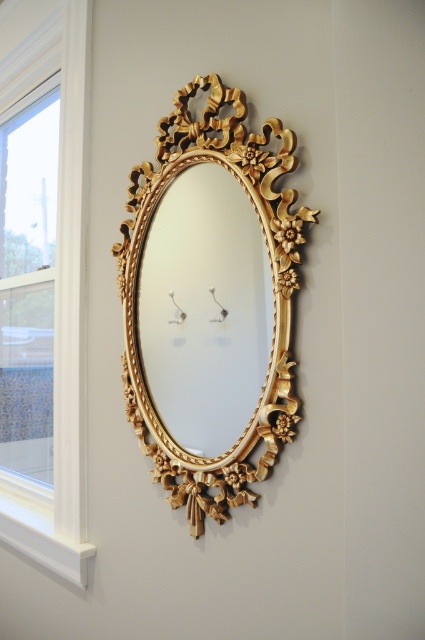
Question: Which of the following is the farthest from the observer?

Choices:
 (A) gold ornate mirror at center
 (B) gold ornate mirror at upper center

Answer: (B)

Question: Can you confirm if gold ornate mirror at upper center is positioned below gold ornate mirror at center?

Choices:
 (A) no
 (B) yes

Answer: (B)

Question: Can you confirm if gold ornate mirror at upper center is positioned below white wood window at left?

Choices:
 (A) yes
 (B) no

Answer: (A)

Question: Does gold ornate mirror at upper center appear under white wood window at left?

Choices:
 (A) yes
 (B) no

Answer: (A)

Question: Which of the following is the farthest from the observer?

Choices:
 (A) (178, 449)
 (B) (54, 332)

Answer: (B)

Question: Estimate the real-world distances between objects in this image. Which object is closer to the gold ornate mirror at upper center?

Choices:
 (A) white wood window at left
 (B) gold ornate mirror at center

Answer: (B)